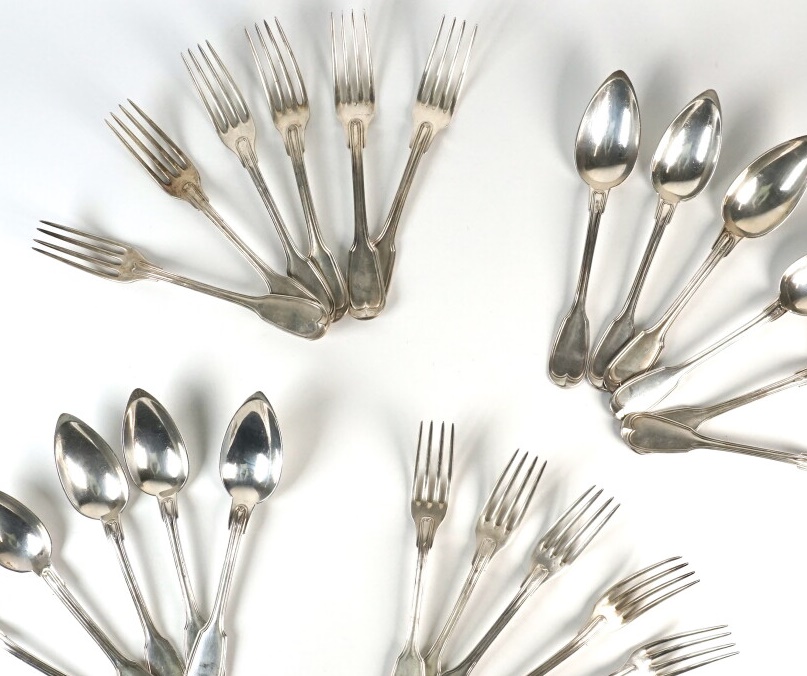
Locate an element on the screen. The width and height of the screenshot is (807, 676). spoons on the right side of the image is located at coordinates (600, 166), (679, 166), (766, 228), (793, 291), (787, 379), (780, 452).